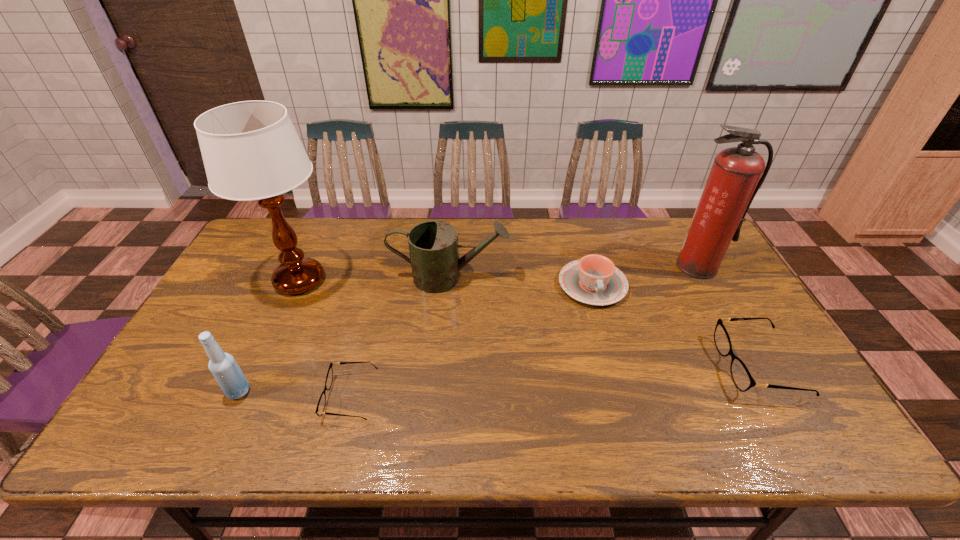
At what (x,y) coordinates should I click in order to perform the action: click on free space between the fifth object from left to right and the right spectacles. Please return your answer as a coordinate pair (x, y). The width and height of the screenshot is (960, 540). Looking at the image, I should click on (675, 325).

Where is `free space between the table lamp and the bottle`? The image size is (960, 540). free space between the table lamp and the bottle is located at coordinates (269, 336).

Locate an element on the screen. Image resolution: width=960 pixels, height=540 pixels. object that is the fifth closest to the table lamp is located at coordinates (736, 175).

Find the location of a particular element. The width and height of the screenshot is (960, 540). object that stands as the closest to the fifth object from left to right is located at coordinates (433, 245).

This screenshot has height=540, width=960. What are the coordinates of `vacant area that satisfies the following two spatial constraints: 1. at the nozzle of the fire extinguisher; 2. with the spout on the watering can` in the screenshot? It's located at (704, 278).

I want to click on vacant space that satisfies the following two spatial constraints: 1. on the handle side of the chinaware; 2. on the front-facing side of the left spectacles, so click(x=623, y=397).

This screenshot has height=540, width=960. Identify the location of vacant space that satisfies the following two spatial constraints: 1. on the handle side of the chinaware; 2. on the front-facing side of the left spectacles. (623, 397).